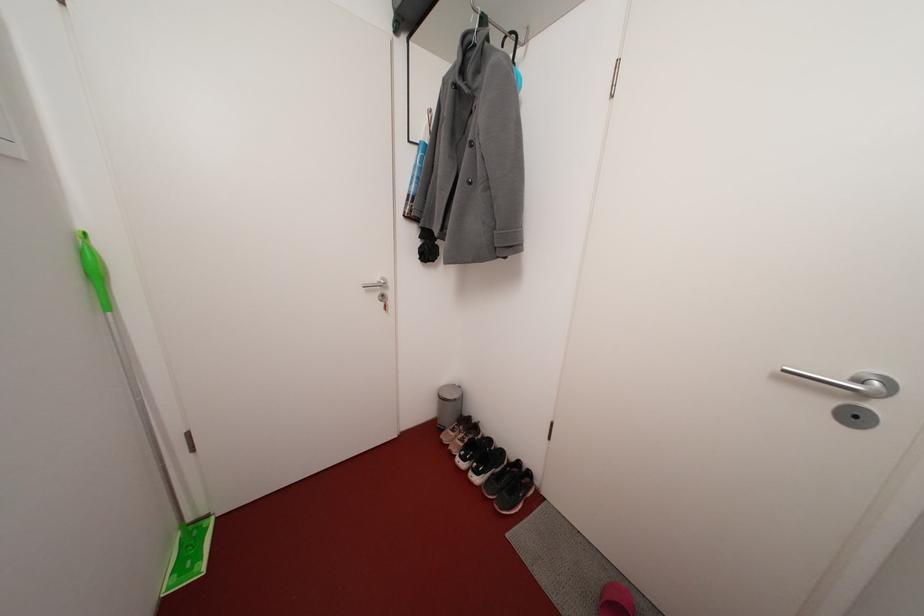
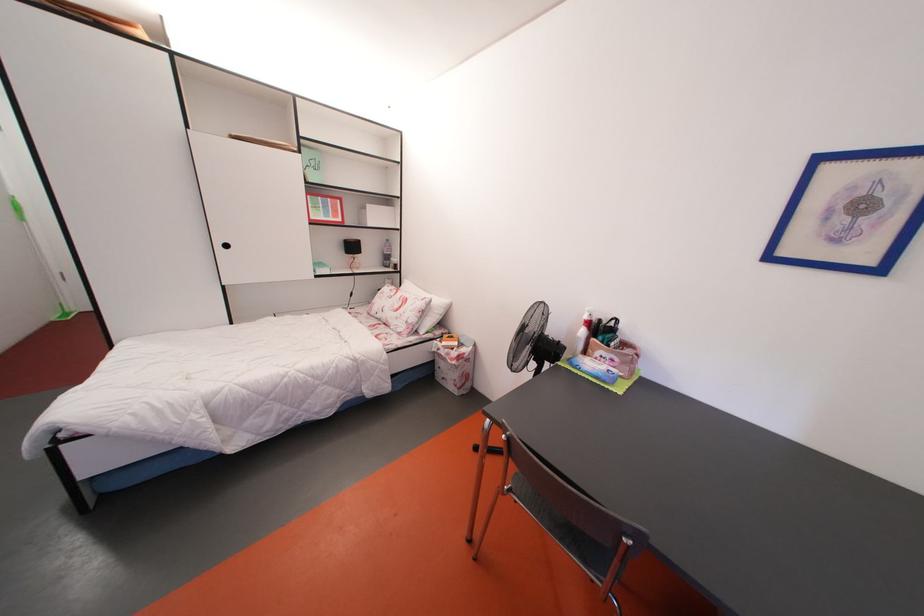
What movement of the cameraman would produce the second image?

The cameraman walked toward right, backward.